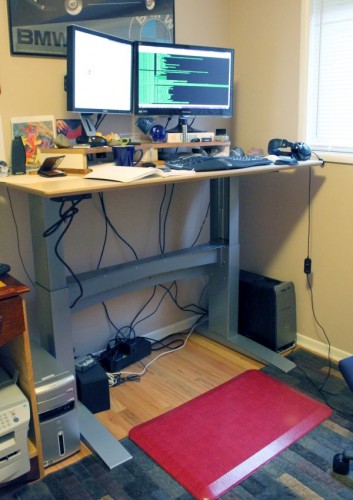
Locate an element on the screen. This screenshot has height=500, width=353. gray metal desk legs is located at coordinates (229, 264), (61, 294).